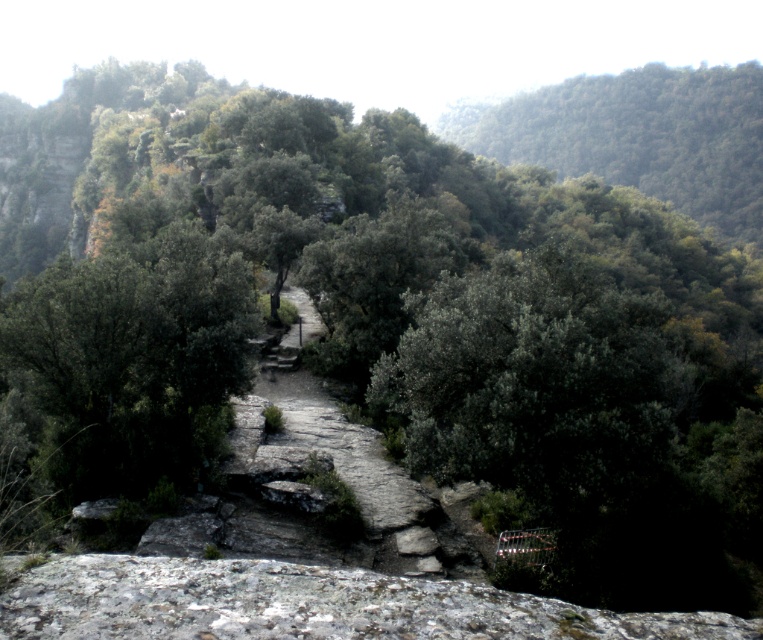
Can you confirm if gray rough rock at lower center is taller than green leafy tree at upper center?

In fact, gray rough rock at lower center may be shorter than green leafy tree at upper center.

Between gray rough rock at lower center and green leafy tree at upper center, which one is positioned higher?

Positioned higher is green leafy tree at upper center.

The image size is (763, 640). What do you see at coordinates (306, 604) in the screenshot?
I see `gray rough rock at lower center` at bounding box center [306, 604].

Find the location of a particular element. gray rough rock at lower center is located at coordinates [x=306, y=604].